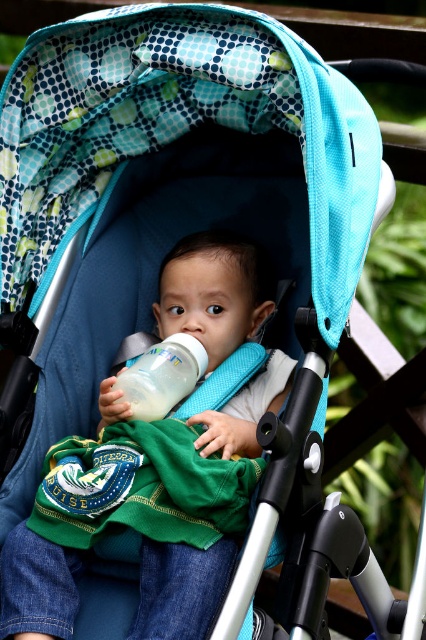
The width and height of the screenshot is (426, 640). Describe the element at coordinates (66, 529) in the screenshot. I see `matte green shirt at center` at that location.

Is matte green shirt at center taller than white opaque bottle at center?

Correct, matte green shirt at center is much taller as white opaque bottle at center.

At what (x,y) coordinates should I click in order to perform the action: click on matte green shirt at center. Please return your answer as a coordinate pair (x, y). Looking at the image, I should click on (66, 529).